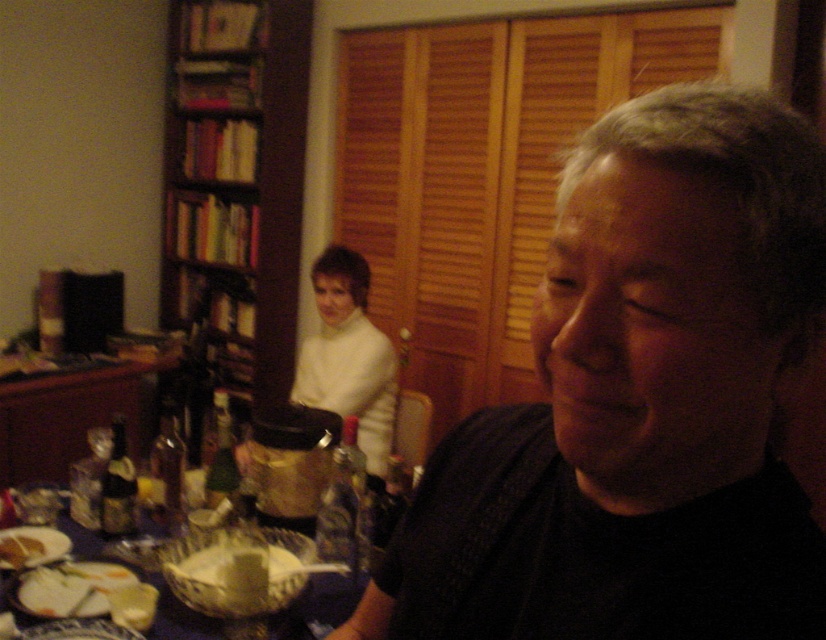
Where is `white sweater at center`? This screenshot has width=826, height=640. white sweater at center is located at coordinates (349, 356).

Is point (293, 385) closer to camera compared to point (50, 492)?

No.

Is point (326, 288) less distant than point (55, 541)?

No, it is not.

At what (x,y) coordinates should I click in order to perform the action: click on white sweater at center. Please return your answer as a coordinate pair (x, y). Looking at the image, I should click on click(x=349, y=356).

Who is shorter, black matte shirt at center or white creamy bread at lower left?

white creamy bread at lower left is shorter.

Is point (733, 502) more distant than point (1, 560)?

No, it is not.

Who is more distant from viewer, (468, 561) or (15, 547)?

Point (15, 547)

This screenshot has width=826, height=640. Find the location of `black matte shirt at center`. black matte shirt at center is located at coordinates (639, 403).

Which is below, wooden bookshelf at left or white creamy bread at lower left?

Positioned lower is white creamy bread at lower left.

Is the position of wooden bookshelf at left more distant than that of white creamy bread at lower left?

Yes, it is behind white creamy bread at lower left.

Describe the element at coordinates (236, 186) in the screenshot. I see `wooden bookshelf at left` at that location.

Find the location of a particular element. This screenshot has width=826, height=640. wooden bookshelf at left is located at coordinates (236, 186).